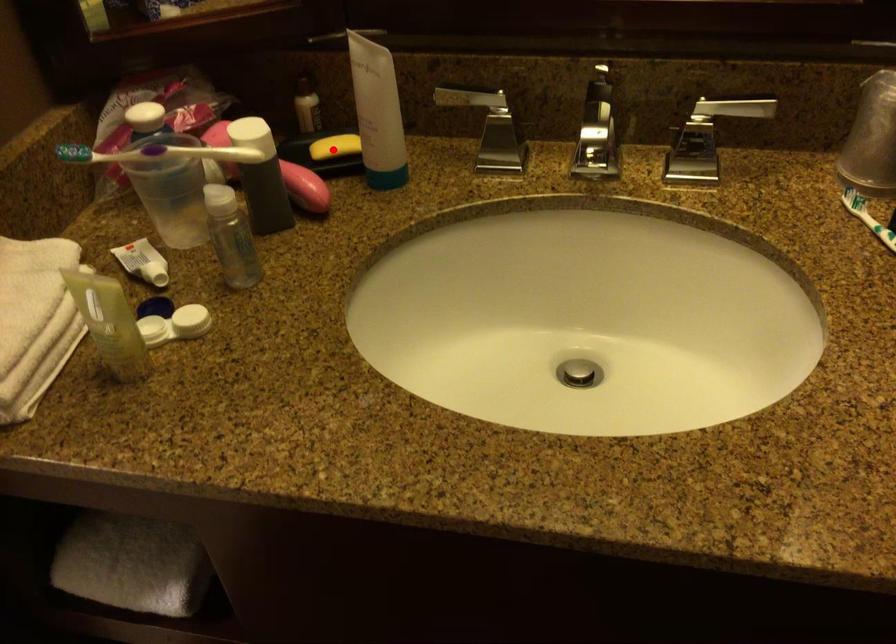
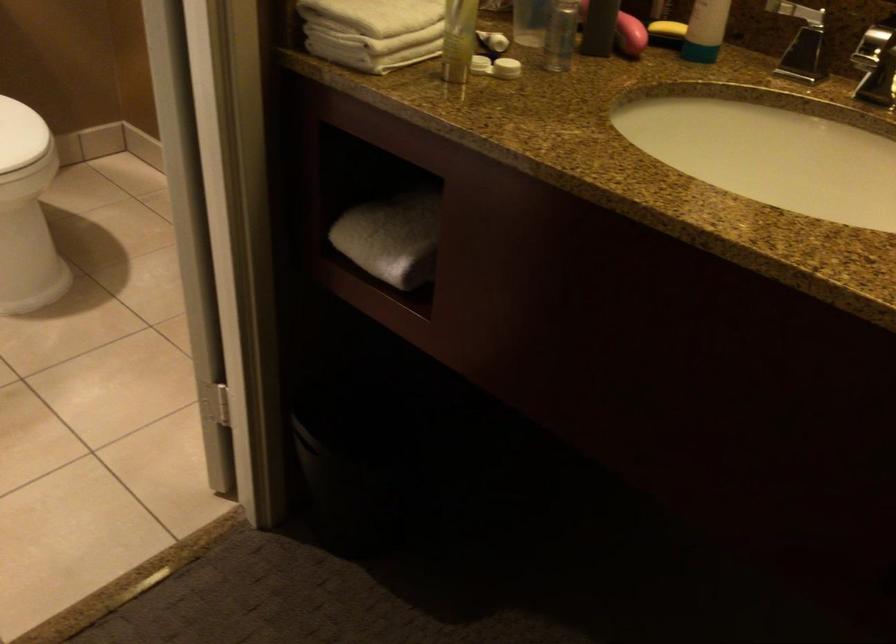
Question: I am providing you with two images of the same scene from different viewpoints. Given a red point in image1, look at the same physical point in image2. Is it:

Choices:
 (A) Closer to the viewpoint
 (B) Farther from the viewpoint

Answer: (B)